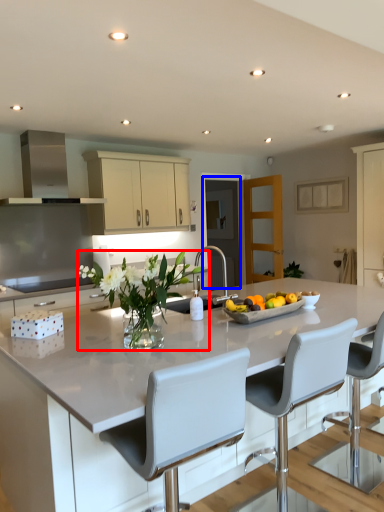
Question: Which object appears closest to the camera in this image, floral arrangement (highlighted by a red box) or glass door (highlighted by a blue box)?

Choices:
 (A) floral arrangement
 (B) glass door

Answer: (A)